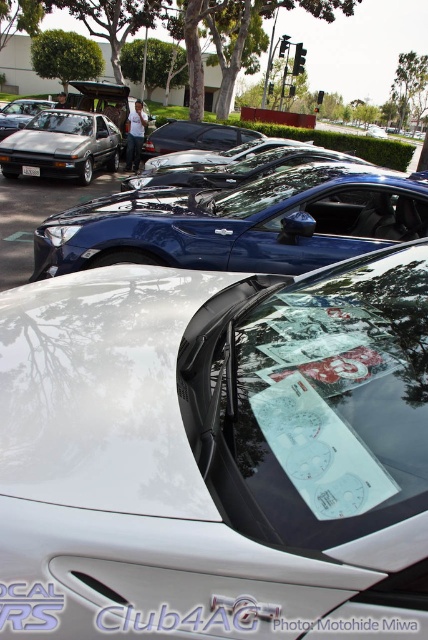
You are standing at the point marked by the coordinates point (62, 145) in the parking lot. Looking around, you see a white car with a speedometer decal on its windshield and a blue sports car. Which car is closer to your current position?

The point (62, 145) indicates metallic silver hatchback at left, so the metallic silver hatchback at left is closer to your current position than the white car with a speedometer decal on its windshield and the blue sports car.

You are a parking attendant who needs to fit a new car into the space between the metallic silver hatchback at left and the black plastic license plate at center. The new car is 1.8 meters wide. Can the new car fit in the available space?

The metallic silver hatchback at left is wider than the black plastic license plate at center. However, the exact width of the space between them isn